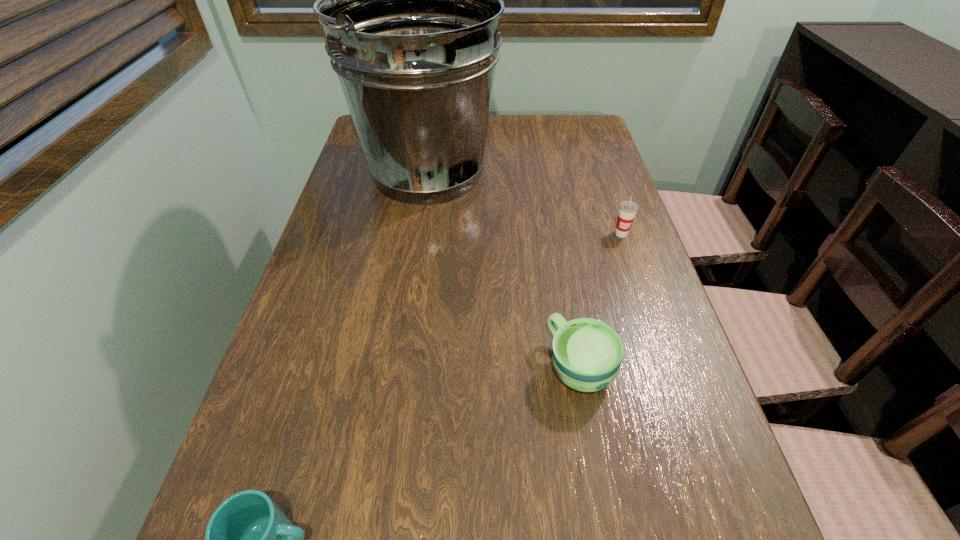
The width and height of the screenshot is (960, 540). In order to click on the tallest object in this screenshot , I will do `click(410, 0)`.

At what (x,y) coordinates should I click in order to perform the action: click on the farthest object. Please return your answer as a coordinate pair (x, y). The image size is (960, 540). Looking at the image, I should click on (410, 0).

Locate an element on the screen. This screenshot has width=960, height=540. the second farthest object is located at coordinates (628, 209).

Identify the location of the rightmost cup. (628, 209).

Locate an element on the screen. The image size is (960, 540). the second cup from left to right is located at coordinates (587, 353).

The height and width of the screenshot is (540, 960). I want to click on the second object from right to left, so click(587, 353).

At what (x,y) coordinates should I click in order to perform the action: click on vacant area situated 0.200m on the front of the farthest object. Please return your answer as a coordinate pair (x, y). Looking at the image, I should click on (412, 274).

The height and width of the screenshot is (540, 960). Find the location of `vacant space located on the side of the farthest cup with the logo`. vacant space located on the side of the farthest cup with the logo is located at coordinates (649, 315).

You are a GUI agent. You are given a task and a screenshot of the screen. Output one action in this format:
    pyautogui.click(x=<x>, y=<y>)
    Task: Click on the free location located on the back of the third object from left to right
    This screenshot has width=960, height=540.
    Given the screenshot: What is the action you would take?
    pyautogui.click(x=553, y=223)

I want to click on object that is at the far edge, so click(410, 0).